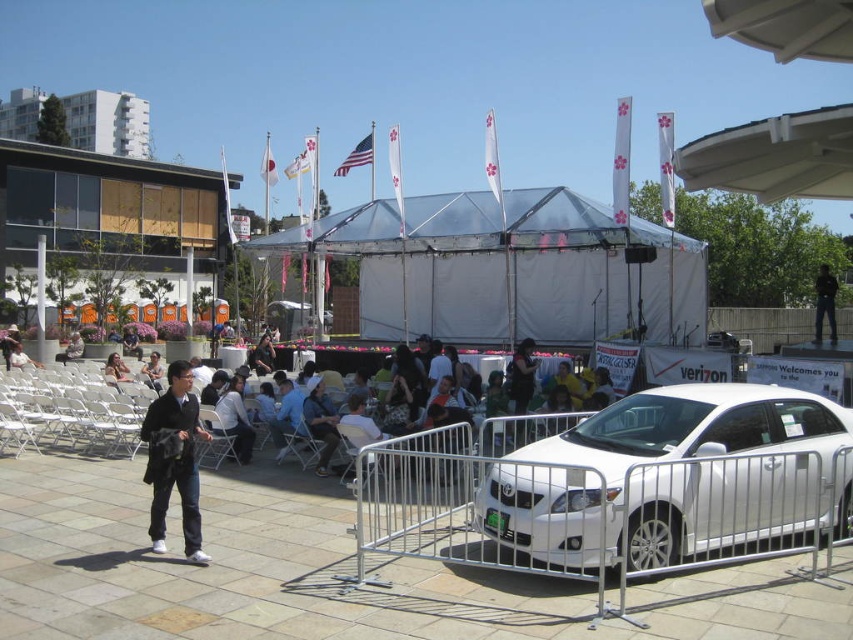
Who is positioned more to the right, black matte jacket at lower left or brown wooden fence at upper right?

brown wooden fence at upper right

Is black matte jacket at lower left behind brown wooden fence at upper right?

No.

Where is `black matte jacket at lower left`? This screenshot has width=853, height=640. black matte jacket at lower left is located at coordinates (173, 460).

Who is positioned more to the left, brown wooden fence at upper right or black leather pants at right?

brown wooden fence at upper right

Measure the distance between point (747, 324) and camera.

The distance of point (747, 324) from camera is 28.10 meters.

Which is behind, point (802, 310) or point (820, 269)?

Positioned behind is point (820, 269).

This screenshot has height=640, width=853. What are the coordinates of `brown wooden fence at upper right` in the screenshot? It's located at (763, 324).

Which of these two, transparent fabric tent at center or light blue shirt at center, stands taller?

transparent fabric tent at center is taller.

Can you confirm if transparent fabric tent at center is thinner than light blue shirt at center?

No.

In the scene shown: Who is more forward, (x=445, y=218) or (x=229, y=392)?

Positioned in front is point (x=229, y=392).

Locate an element on the screen. Image resolution: width=853 pixels, height=640 pixels. transparent fabric tent at center is located at coordinates (509, 269).